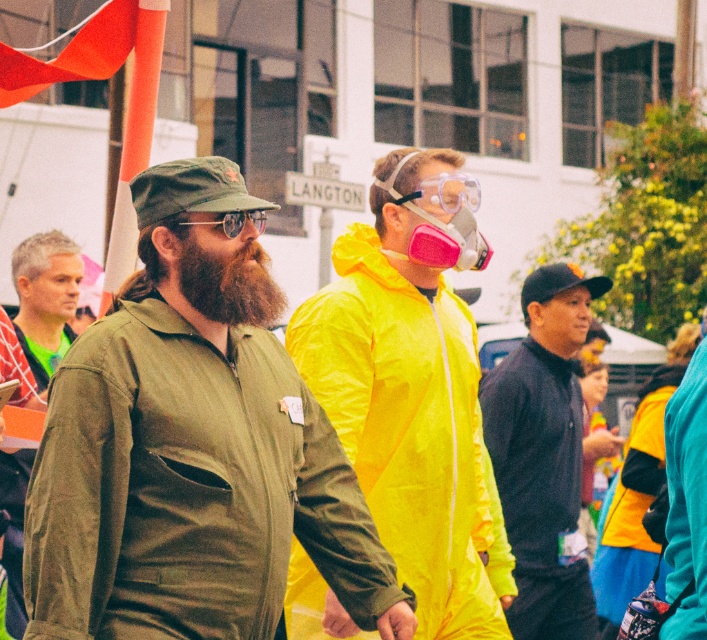
Question: Can you confirm if matte green jacket at center is positioned to the right of matte green jacket at left?

Choices:
 (A) yes
 (B) no

Answer: (A)

Question: Which of the following is the farthest from the observer?

Choices:
 (A) matte green jacket at center
 (B) brownwoollybeard at center
 (C) black fleece jacket at center

Answer: (C)

Question: Which point is farther from the camera taking this photo?

Choices:
 (A) (230, 214)
 (B) (380, 486)
 (C) (554, 445)

Answer: (C)

Question: Does neon yellow raincoat at center have a larger size compared to pink matte gas mask at center?

Choices:
 (A) yes
 (B) no

Answer: (A)

Question: Which object is farther from the camera taking this photo?

Choices:
 (A) matte green jacket at left
 (B) neon yellow raincoat at center
 (C) reflective plastic goggles at center

Answer: (A)

Question: Is matte green jacket at center smaller than neon yellow raincoat at center?

Choices:
 (A) no
 (B) yes

Answer: (A)